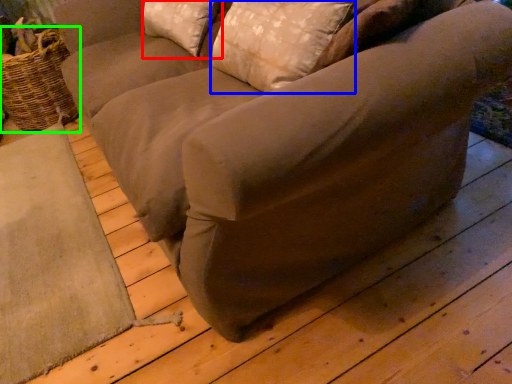
Question: Estimate the real-world distances between objects in this image. Which object is closer to pillow (highlighted by a red box), pillow (highlighted by a blue box) or basket (highlighted by a green box)?

Choices:
 (A) pillow
 (B) basket

Answer: (A)